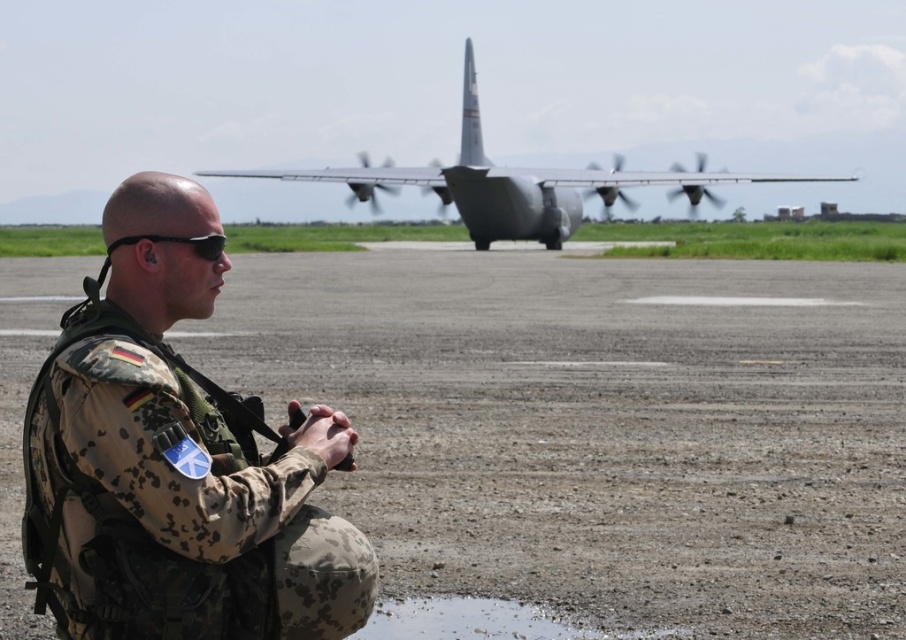
You are a drone operator controlling a drone with a 40 meter maximum flight range. You are positioned at the location of the black matte sunglasses at left and want to fly the drone to the silver metallic airplane at center. Can the drone reach the airplane?

The distance between the silver metallic airplane at center and black matte sunglasses at left is 39.72 meters, which is within the drone operator maximum flight range of 40 meters. Therefore, the drone can reach the airplane.

You are a pilot preparing to board the silver metallic airplane at center. As you walk from the dull gray tarmac at center towards the airplane, which direction should you move relative to the airplane?

Since the dull gray tarmac at center is positioned on the left side of the silver metallic airplane at center, you should move to the right to reach the airplane from the tarmac.

You are a photographer positioned at the edge of the airfield. You want to take a photo of the silver metallic airplane at center without the dull gray tarmac at center appearing in the foreground. Is this possible given your current position?

The dull gray tarmac at center is in front of the silver metallic airplane at center, so if you are positioned at the edge of the airfield, the tarmac would block the view of the airplane. To avoid the tarmac in the foreground, you would need to reposition yourself to a location where the airplane is not obscured by the tarmac.